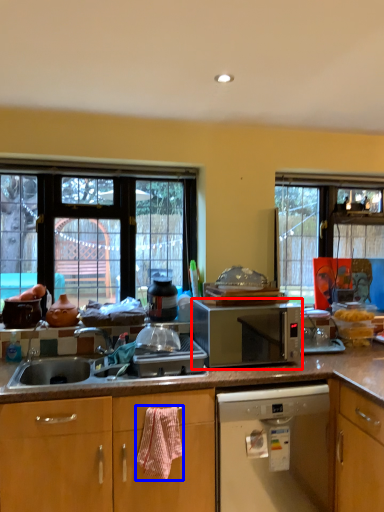
Question: Which object appears farthest to the camera in this image, microwave oven (highlighted by a red box) or material (highlighted by a blue box)?

Choices:
 (A) microwave oven
 (B) material

Answer: (A)